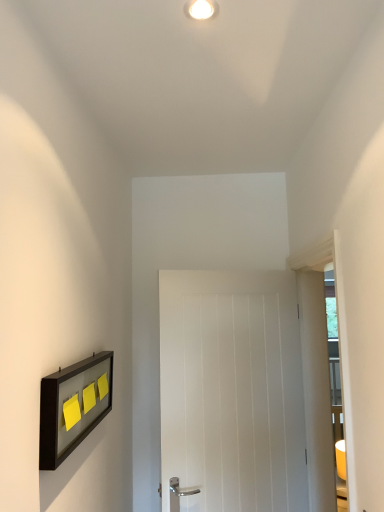
Question: Does white wooden door at center have a greater height compared to white glossy light fixture at upper center?

Choices:
 (A) no
 (B) yes

Answer: (B)

Question: Is white wooden door at center positioned far away from white glossy light fixture at upper center?

Choices:
 (A) yes
 (B) no

Answer: (A)

Question: Considering the relative sizes of white wooden door at center and white glossy light fixture at upper center in the image provided, is white wooden door at center wider than white glossy light fixture at upper center?

Choices:
 (A) no
 (B) yes

Answer: (B)

Question: Is white wooden door at center positioned behind white glossy light fixture at upper center?

Choices:
 (A) no
 (B) yes

Answer: (B)

Question: Does white wooden door at center lie in front of white glossy light fixture at upper center?

Choices:
 (A) yes
 (B) no

Answer: (B)

Question: Is point (319, 379) positioned closer to the camera than point (84, 398)?

Choices:
 (A) closer
 (B) farther

Answer: (B)

Question: Considering the positions of transparent glass door at right and yellow matte/light switch at left, which is the 2th light switch in front-to-back order, in the image, is transparent glass door at right taller or shorter than yellow matte/light switch at left, which is the 2th light switch in front-to-back order,?

Choices:
 (A) tall
 (B) short

Answer: (A)

Question: In terms of width, does transparent glass door at right look wider or thinner when compared to yellow matte/light switch at left, which ranks as the 1th light switch in back-to-front order?

Choices:
 (A) thin
 (B) wide

Answer: (B)

Question: In the image, is transparent glass door at right positioned in front of or behind yellow matte/light switch at left, which is the 2th light switch in front-to-back order?

Choices:
 (A) behind
 (B) front

Answer: (B)

Question: From their relative heights in the image, would you say white wooden door at center is taller or shorter than matte black picture frame at left?

Choices:
 (A) tall
 (B) short

Answer: (A)

Question: Looking at the image, does white wooden door at center seem bigger or smaller compared to matte black picture frame at left?

Choices:
 (A) small
 (B) big

Answer: (B)

Question: Is white wooden door at center inside or outside of matte black picture frame at left?

Choices:
 (A) outside
 (B) inside

Answer: (A)

Question: From a real-world perspective, is white wooden door at center above or below matte black picture frame at left?

Choices:
 (A) above
 (B) below

Answer: (B)

Question: From their relative heights in the image, would you say yellow matte/light switch at left, which ranks as the 1th light switch in back-to-front order, is taller or shorter than matte black picture frame at left?

Choices:
 (A) tall
 (B) short

Answer: (B)

Question: In terms of width, does yellow matte/light switch at left, which is the 2th light switch in front-to-back order, look wider or thinner when compared to matte black picture frame at left?

Choices:
 (A) thin
 (B) wide

Answer: (A)